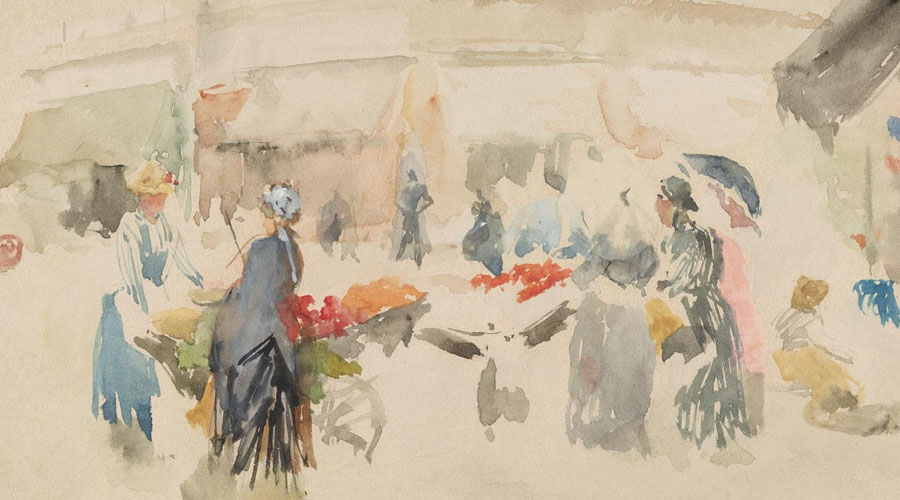
This screenshot has width=900, height=500. What are the coordinates of `painting` in the screenshot? It's located at (469, 146).